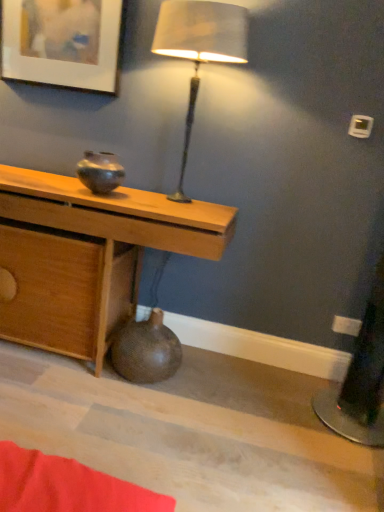
Question: From a real-world perspective, is wooden desk at center above or below matte white picture frame at upper left?

Choices:
 (A) below
 (B) above

Answer: (A)

Question: Is point (99, 356) positioned closer to the camera than point (54, 49)?

Choices:
 (A) farther
 (B) closer

Answer: (B)

Question: Which object is the closest to the matte white picture frame at upper left?

Choices:
 (A) brown textured vase at lower center, placed as the first vase when sorted from bottom to top
 (B) satin beige lampshade at upper center
 (C) wooden desk at center
 (D) shiny metallic vase at center, placed as the first vase when sorted from top to bottom

Answer: (B)

Question: Which of these objects is positioned farthest from the shiny metallic vase at center, placed as the first vase when sorted from top to bottom?

Choices:
 (A) satin beige lampshade at upper center
 (B) wooden desk at center
 (C) brown textured vase at lower center, placed as the first vase when sorted from bottom to top
 (D) matte white picture frame at upper left

Answer: (C)